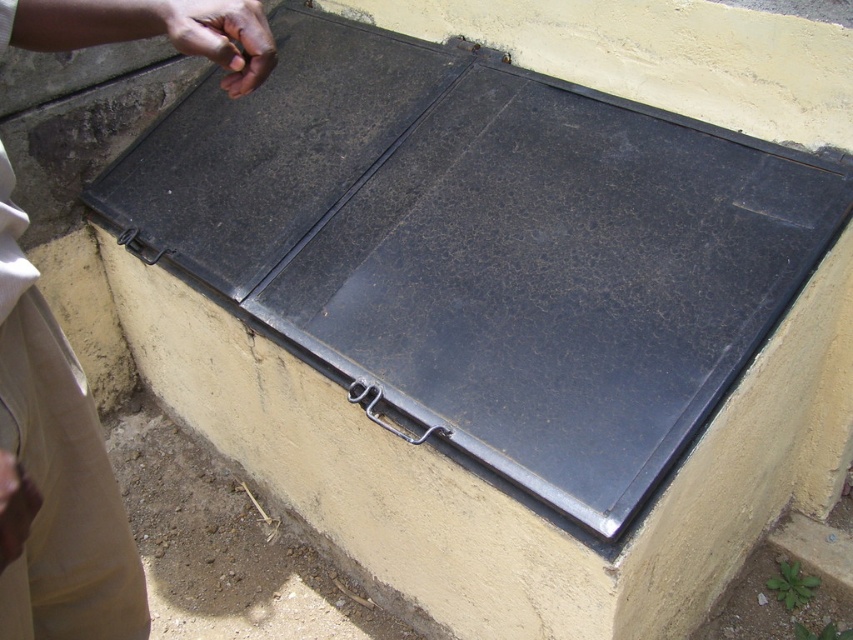
Can you confirm if beige fabric pants at lower left is smaller than dark skin hand at upper left?

No.

Where is `beige fabric pants at lower left`? This screenshot has width=853, height=640. beige fabric pants at lower left is located at coordinates (54, 474).